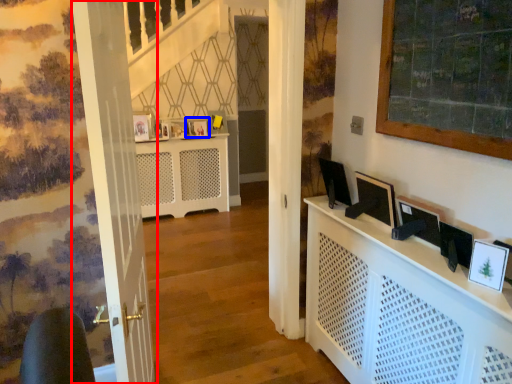
Question: Which object appears farthest to the camera in this image, door (highlighted by a red box) or picture frame (highlighted by a blue box)?

Choices:
 (A) door
 (B) picture frame

Answer: (B)